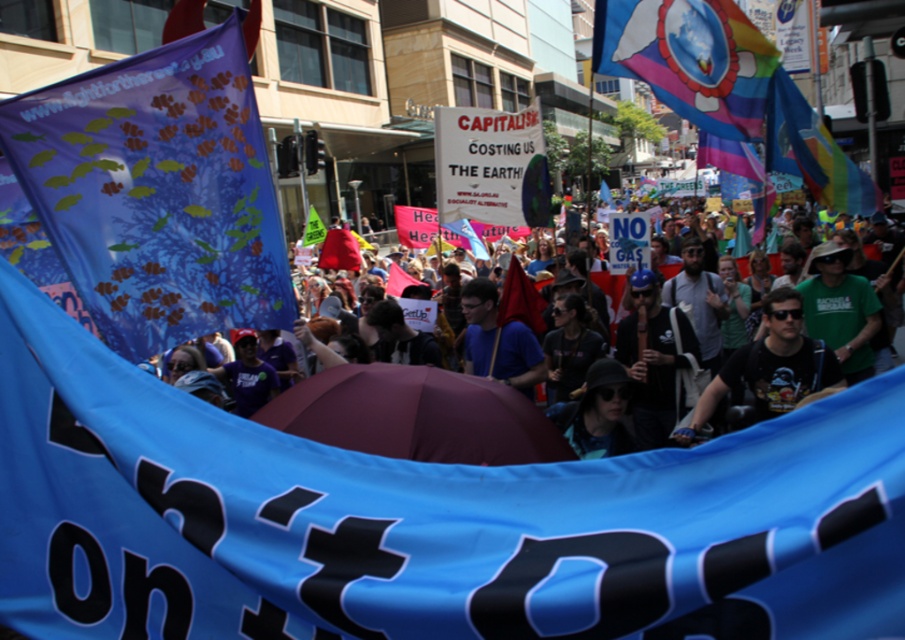
You are a photographer trying to capture the protest scene. You want to ensure both the blue fabric banner with fish prints at left and the blue fabric crowd at center are visible in your shot. Given their sizes, which object should you focus on to frame the scene properly?

The blue fabric banner with fish prints at left is taller than the blue fabric crowd at center, so focusing on the banner will help frame the scene to include both elements effectively.

You are a protest organizer who needs to ensure that the sound system can reach both the blue fabric banner with fish prints at left and the blue fabric crowd at center. The sound system has a maximum effective range of 4 feet. Can the sound system adequately cover both areas?

The distance between the blue fabric banner with fish prints at left and the blue fabric crowd at center is 4.19 feet, which exceeds the sound system maximum effective range of 4 feet. Therefore, the sound system cannot adequately cover both areas.